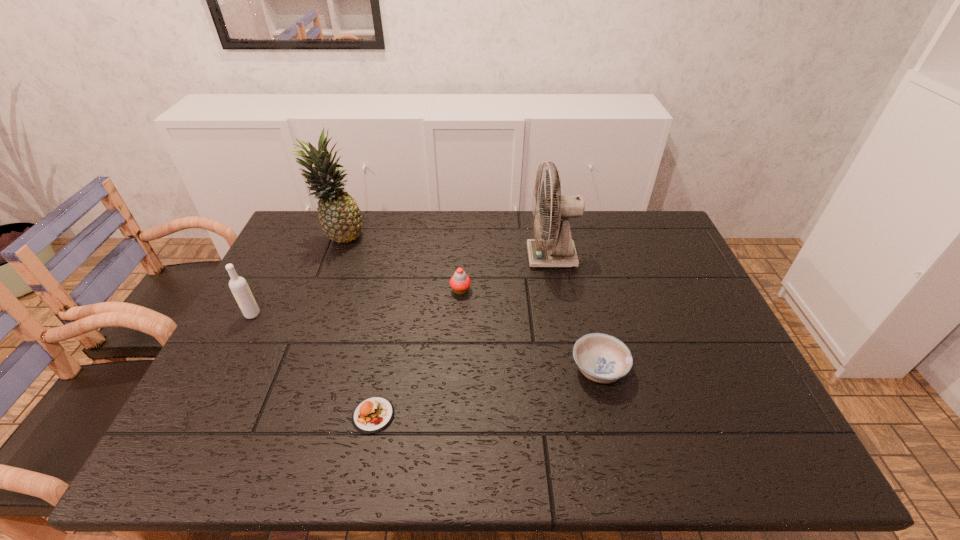
Identify the location of free spot located on the front of the fifth object from right to left. (306, 320).

This screenshot has height=540, width=960. In order to click on vacant area located 0.260m on the front-facing side of the fan in this screenshot , I will do `click(446, 257)`.

Image resolution: width=960 pixels, height=540 pixels. I want to click on free space located 0.320m on the front-facing side of the fan, so click(427, 257).

Find the location of a particular element. This screenshot has height=540, width=960. vacant space located 0.380m on the front-facing side of the fan is located at coordinates (409, 257).

In order to click on blank area located on the right of the fourth farthest object in this screenshot , I will do `click(296, 314)`.

Image resolution: width=960 pixels, height=540 pixels. Find the location of `vacant region located on the left of the fourth tallest object`. vacant region located on the left of the fourth tallest object is located at coordinates [x=398, y=291].

You are a GUI agent. You are given a task and a screenshot of the screen. Output one action in this format:
    pyautogui.click(x=<x>, y=<y>)
    Task: Click on the vacant space situated on the back of the second shortest object
    
    Given the screenshot: What is the action you would take?
    587,321

Locate an element on the screen. free space located on the back of the fourth object from right to left is located at coordinates (383, 366).

Where is `pineapple that is at the far edge`? pineapple that is at the far edge is located at coordinates (339, 215).

Locate an element on the screen. fan at the far edge is located at coordinates (560, 251).